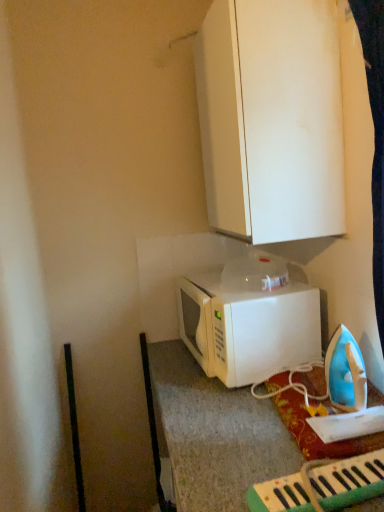
Identify the location of white matte microwave at center. Image resolution: width=384 pixels, height=512 pixels. (249, 320).

Where is `white matte cabinet at upper center`? The image size is (384, 512). white matte cabinet at upper center is located at coordinates (271, 118).

Considering the relative positions of white matte microwave at center and green plastic keyboard at lower right in the image provided, is white matte microwave at center to the right of green plastic keyboard at lower right from the viewer's perspective?

No.

Does white matte microwave at center have a greater width compared to green plastic keyboard at lower right?

No.

Is white matte microwave at center inside the boundaries of green plastic keyboard at lower right, or outside?

white matte microwave at center is not enclosed by green plastic keyboard at lower right.

In terms of height, does white matte microwave at center look taller or shorter compared to green plastic keyboard at lower right?

In the image, white matte microwave at center appears to be taller than green plastic keyboard at lower right.

Can you confirm if green plastic keyboard at lower right is positioned to the left of white matte microwave at center?

No, green plastic keyboard at lower right is not to the left of white matte microwave at center.

Considering the relative positions of green plastic keyboard at lower right and white matte microwave at center in the image provided, is green plastic keyboard at lower right in front of white matte microwave at center?

Yes, green plastic keyboard at lower right is closer to the camera.

From the image's perspective, who appears lower, green plastic keyboard at lower right or white matte microwave at center?

green plastic keyboard at lower right.

Does green plastic keyboard at lower right have a greater width compared to white matte microwave at center?

Yes, green plastic keyboard at lower right is wider than white matte microwave at center.

Which is more to the left, green plastic keyboard at lower right or white matte cabinet at upper center?

white matte cabinet at upper center.

From the image's perspective, which one is positioned higher, green plastic keyboard at lower right or white matte cabinet at upper center?

white matte cabinet at upper center is shown above in the image.

Is green plastic keyboard at lower right oriented away from white matte cabinet at upper center?

No.

Is point (370, 463) behind point (296, 144)?

That is False.

Is the position of white matte cabinet at upper center more distant than that of green plastic keyboard at lower right?

Yes, white matte cabinet at upper center is further from the camera.

Is white matte cabinet at upper center next to green plastic keyboard at lower right?

No, white matte cabinet at upper center is not in contact with green plastic keyboard at lower right.

Is white matte cabinet at upper center to the left or to the right of green plastic keyboard at lower right in the image?

white matte cabinet at upper center is to the left of green plastic keyboard at lower right.

From the picture: From the image's perspective, would you say white matte cabinet at upper center is positioned over green plastic keyboard at lower right?

Yes, from the image's perspective, white matte cabinet at upper center is on top of green plastic keyboard at lower right.

From a real-world perspective, which object rests below the other?

white matte microwave at center.

From their relative heights in the image, would you say white matte microwave at center is taller or shorter than white matte cabinet at upper center?

white matte microwave at center is shorter than white matte cabinet at upper center.

Is white matte microwave at center far from white matte cabinet at upper center?

No.

Between white matte cabinet at upper center and white matte microwave at center, which one has larger size?

white matte cabinet at upper center is bigger.

The width and height of the screenshot is (384, 512). Find the location of `microwave oven that is behind the white matte cabinet at upper center`. microwave oven that is behind the white matte cabinet at upper center is located at coordinates (249, 320).

Would you say white matte cabinet at upper center is inside or outside white matte microwave at center?

white matte cabinet at upper center is not enclosed by white matte microwave at center.

At what (x,y) coordinates should I click in order to perform the action: click on microwave oven on the left of the green plastic keyboard at lower right. Please return your answer as a coordinate pair (x, y). Looking at the image, I should click on (249, 320).

Locate an element on the screen. This screenshot has height=512, width=384. musical keyboard on the right of white matte microwave at center is located at coordinates (348, 480).

Which object lies further to the anchor point white matte microwave at center, white matte cabinet at upper center or green plastic keyboard at lower right?

green plastic keyboard at lower right.

Estimate the real-world distances between objects in this image. Which object is further from white matte cabinet at upper center, white matte microwave at center or green plastic keyboard at lower right?

Among the two, green plastic keyboard at lower right is located further to white matte cabinet at upper center.

Looking at the image, which one is located further to green plastic keyboard at lower right, white matte microwave at center or white matte cabinet at upper center?

The object further to green plastic keyboard at lower right is white matte cabinet at upper center.

Looking at the image, which one is located further to white matte cabinet at upper center, green plastic keyboard at lower right or white matte microwave at center?

The object further to white matte cabinet at upper center is green plastic keyboard at lower right.

Considering their positions, is white matte cabinet at upper center positioned further to green plastic keyboard at lower right than white matte microwave at center?

Among the two, white matte cabinet at upper center is located further to green plastic keyboard at lower right.

Considering their positions, is green plastic keyboard at lower right positioned closer to white matte microwave at center than white matte cabinet at upper center?

The object closer to white matte microwave at center is white matte cabinet at upper center.

Identify the location of microwave oven between white matte cabinet at upper center and green plastic keyboard at lower right from top to bottom. (249, 320).